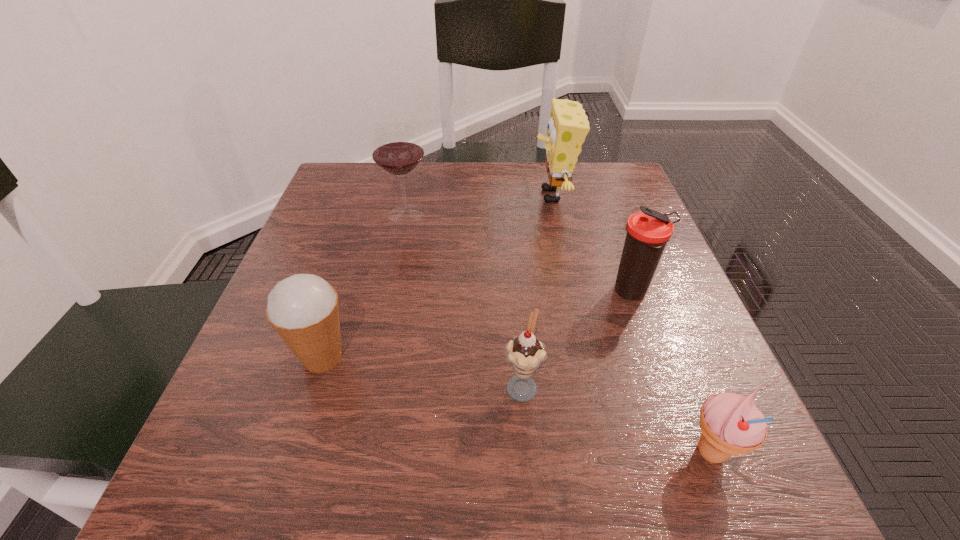
The width and height of the screenshot is (960, 540). What are the coordinates of `sponge that is at the right edge` in the screenshot? It's located at (567, 128).

I want to click on thermos bottle that is at the right edge, so click(x=648, y=232).

Find the location of a particular element. This screenshot has width=960, height=540. icecream at the right edge is located at coordinates (731, 424).

Locate an element on the screen. object that is at the far left corner is located at coordinates (397, 149).

Locate an element on the screen. This screenshot has width=960, height=540. object situated at the far right corner is located at coordinates (567, 128).

Where is `object located at the near right corner`? object located at the near right corner is located at coordinates pos(731,424).

The height and width of the screenshot is (540, 960). I want to click on free space at the far edge, so click(509, 213).

You are a GUI agent. You are given a task and a screenshot of the screen. Output one action in this format:
    pyautogui.click(x=<x>, y=<y>)
    Task: Click on the free space at the near edge
    This screenshot has width=960, height=540.
    Given the screenshot: What is the action you would take?
    pyautogui.click(x=347, y=490)

The height and width of the screenshot is (540, 960). I want to click on vacant area at the left edge of the desktop, so click(366, 286).

In order to click on free space at the right edge in this screenshot , I will do `click(613, 248)`.